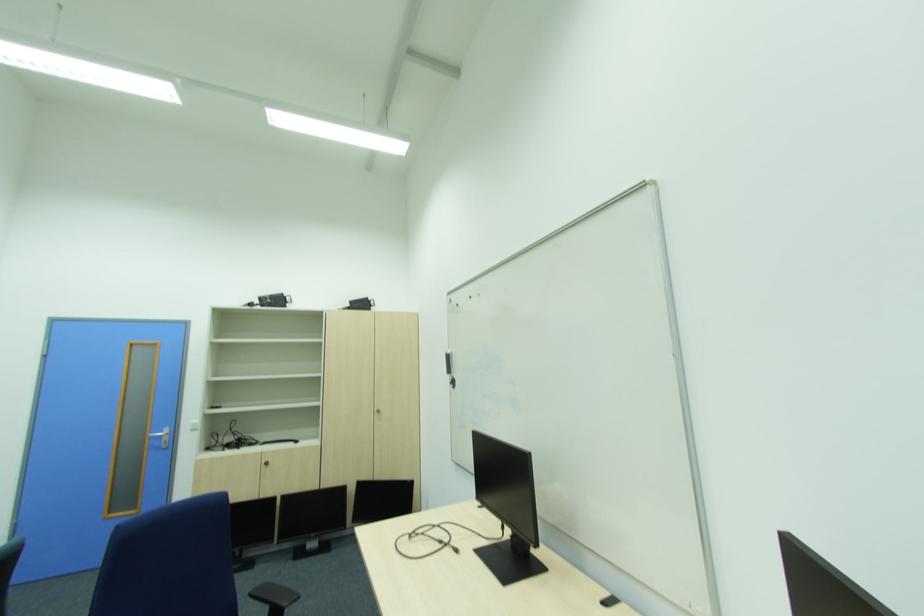
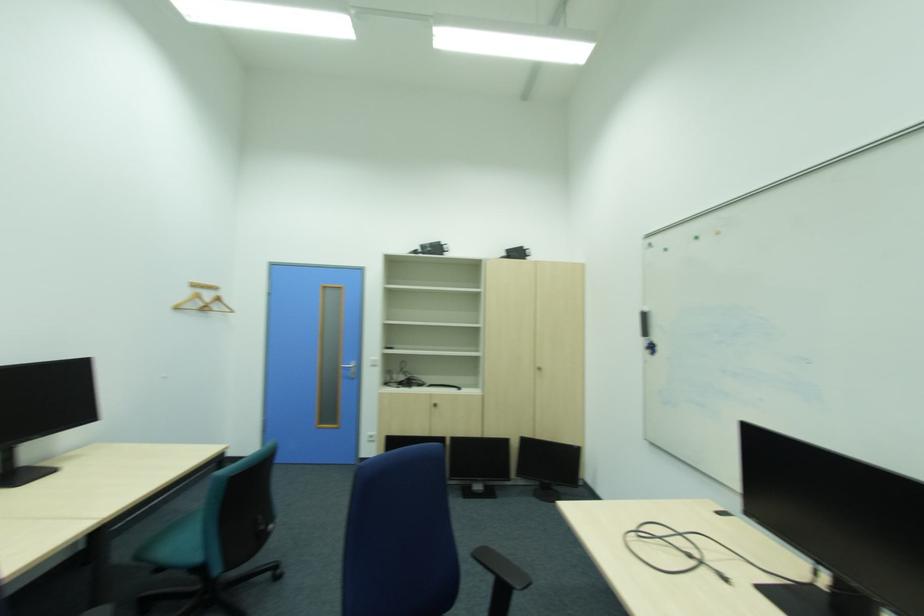
Question: I am providing you with two images of the same scene from different viewpoints. Please identify which objects are invisible in image2.

Choices:
 (A) silver door handle
 (B) chair sitting surface
 (C) black chair armrest
 (D) none of these

Answer: (D)